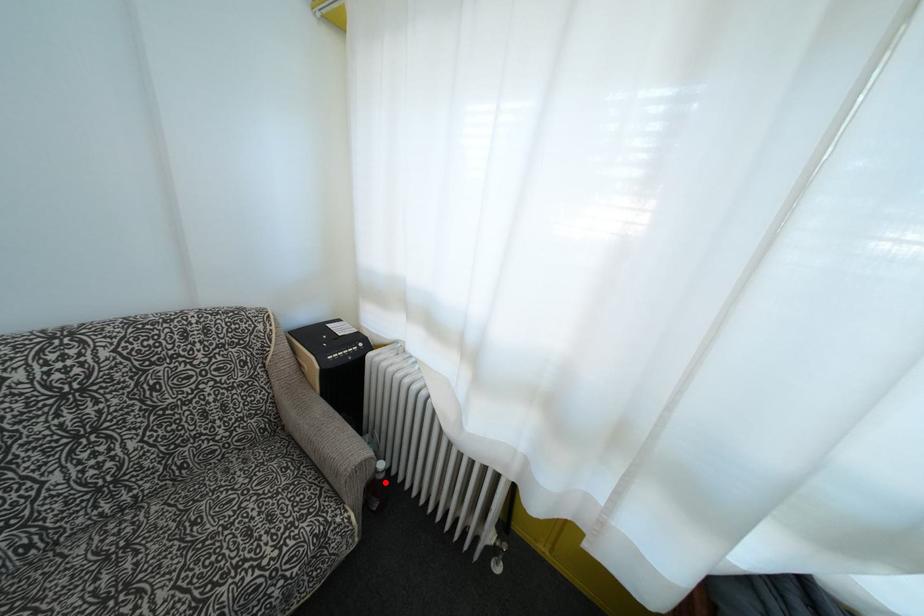
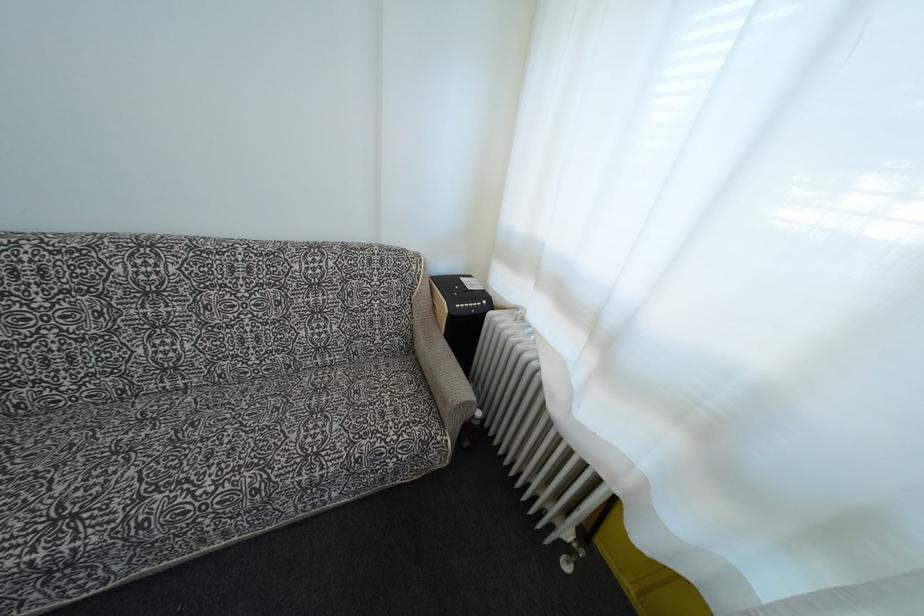
Question: I am providing you with two images of the same scene from different viewpoints. Given a red point in image1, look at the same physical point in image2. Is it:

Choices:
 (A) Closer to the viewpoint
 (B) Farther from the viewpoint

Answer: (B)